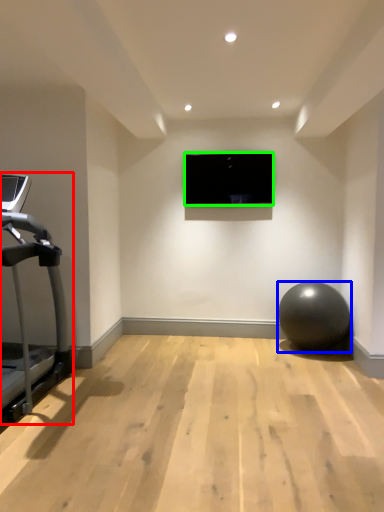
Question: Estimate the real-world distances between objects in this image. Which object is closer to treadmill (highlighted by a red box), ball (highlighted by a blue box) or computer screen (highlighted by a green box)?

Choices:
 (A) ball
 (B) computer screen

Answer: (B)